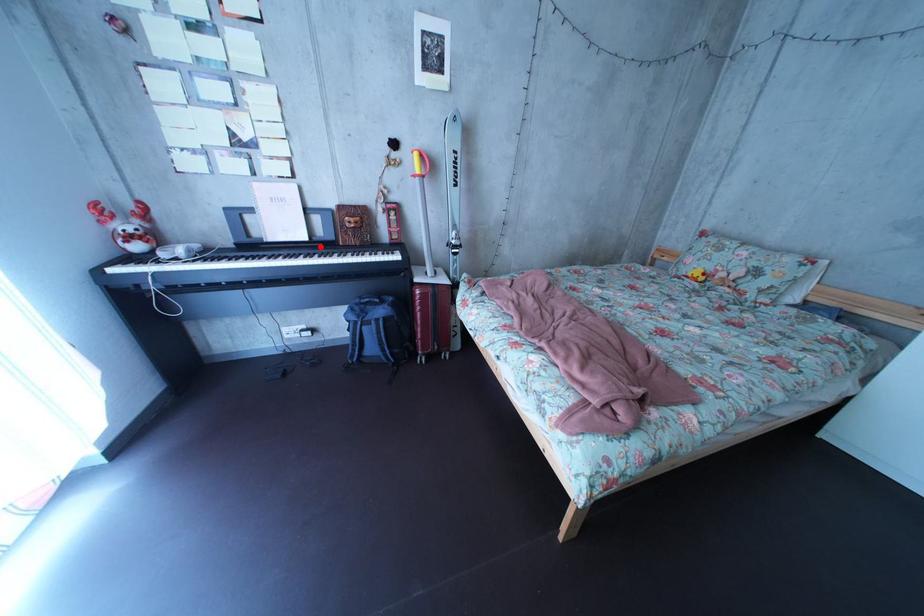
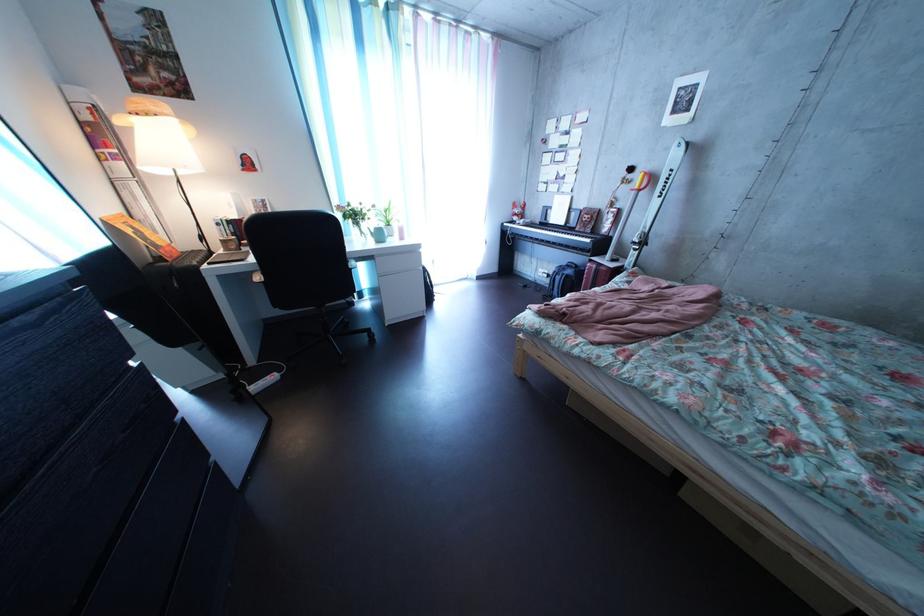
Question: I am providing you with two images of the same scene from different viewpoints. A red point is shown in image1. For the corresponding object point in image2, is it positioned nearer or farther from the camera?

Choices:
 (A) Nearer
 (B) Farther

Answer: (A)